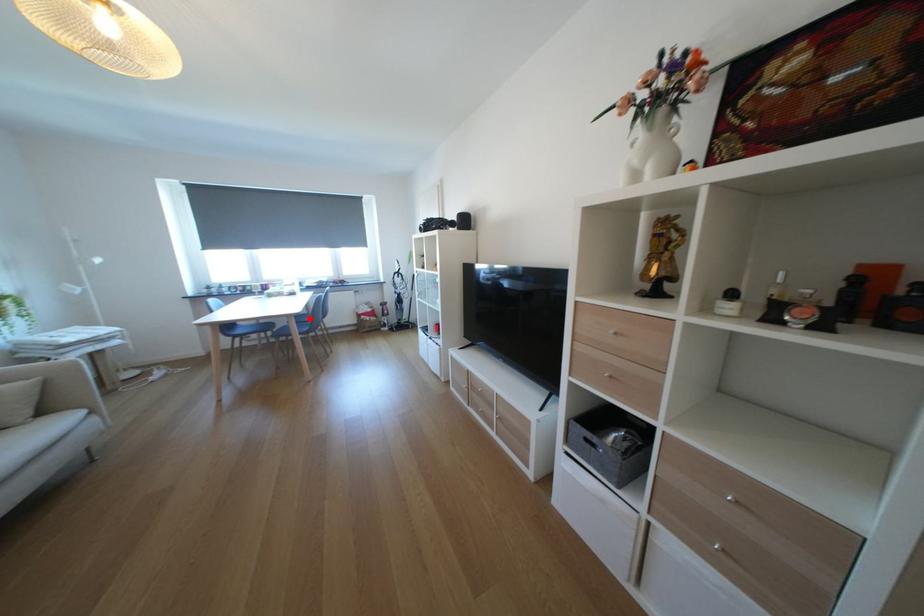
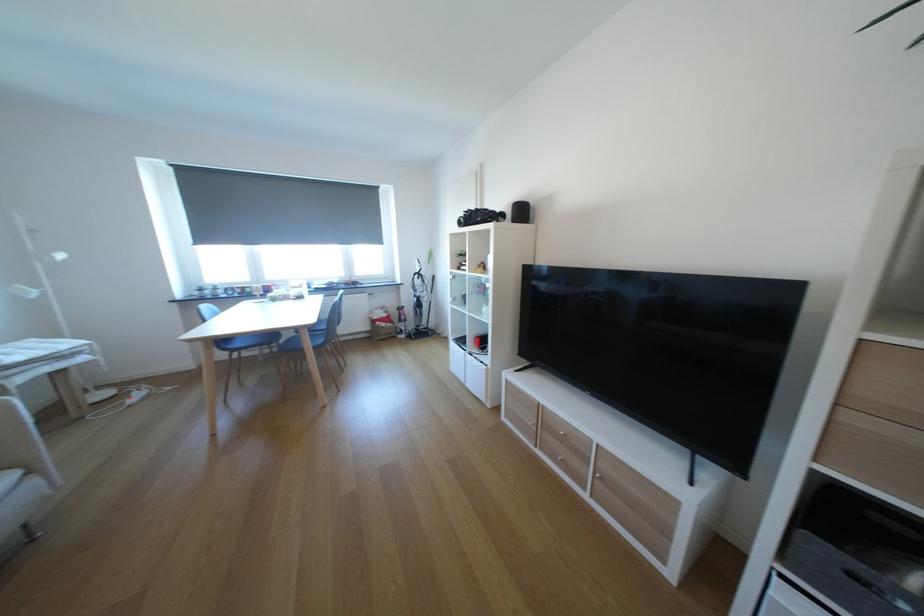
Question: I am providing you with two images of the same scene from different viewpoints. Given a red point in image1, look at the same physical point in image2. Is it:

Choices:
 (A) Closer to the viewpoint
 (B) Farther from the viewpoint

Answer: (A)